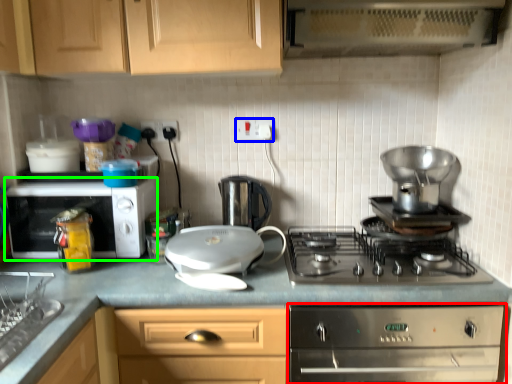
Question: Considering the real-world distances, which object is closest to home appliance (highlighted by a red box)? electric outlet (highlighted by a blue box) or microwave oven (highlighted by a green box).

Choices:
 (A) electric outlet
 (B) microwave oven

Answer: (B)